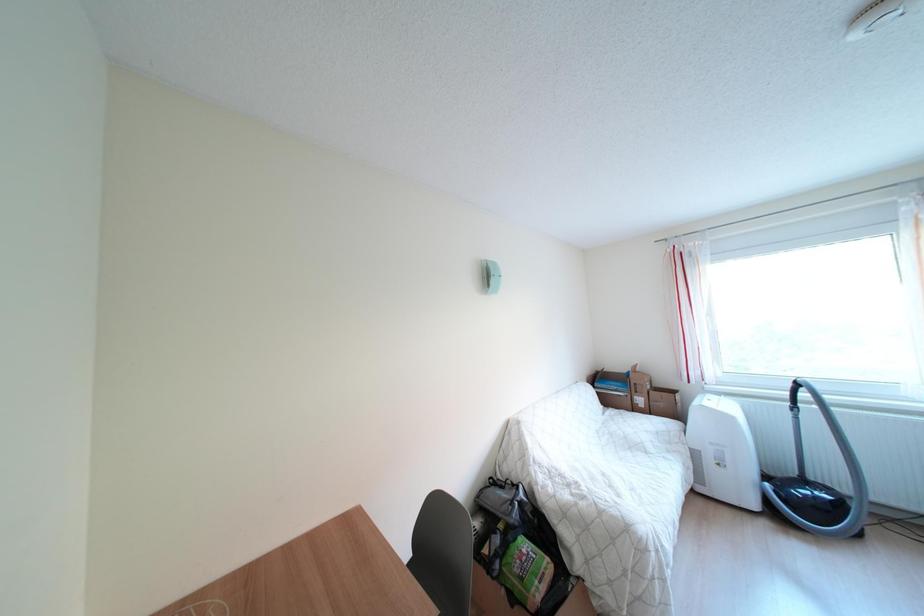
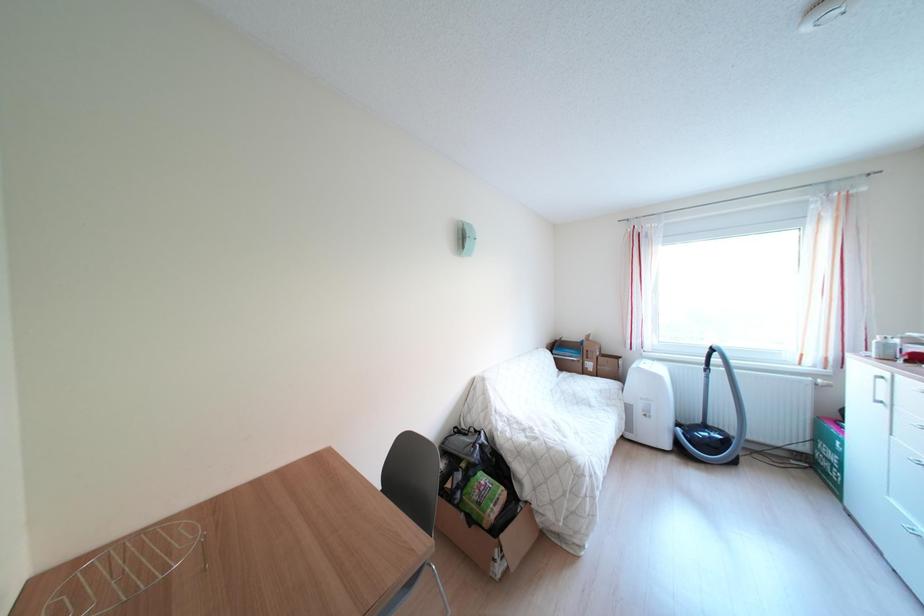
What movement of the cameraman would produce the second image?

The cameraman walked toward left, backward.